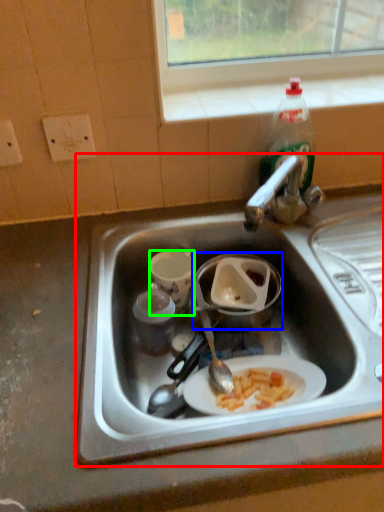
Question: Considering the real-world distances, which object is farthest from sink (highlighted by a red box)? appliance (highlighted by a blue box) or coffee cup (highlighted by a green box)?

Choices:
 (A) appliance
 (B) coffee cup

Answer: (B)